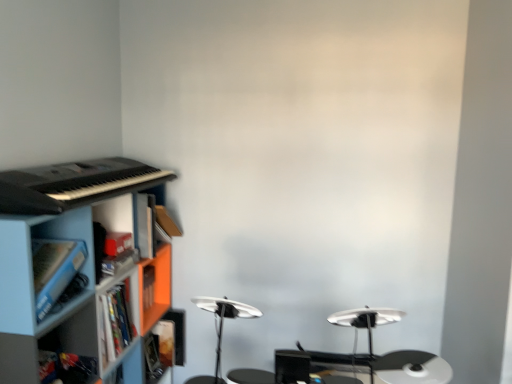
Question: Is blue plastic shelf at lower left in contact with hardcover book at lower left?

Choices:
 (A) no
 (B) yes

Answer: (A)

Question: From a real-world perspective, is blue plastic shelf at lower left positioned under hardcover book at lower left based on gravity?

Choices:
 (A) yes
 (B) no

Answer: (B)

Question: Does blue plastic shelf at lower left lie in front of hardcover book at lower left?

Choices:
 (A) no
 (B) yes

Answer: (B)

Question: Is blue plastic shelf at lower left oriented away from hardcover book at lower left?

Choices:
 (A) yes
 (B) no

Answer: (A)

Question: From the image's perspective, would you say blue plastic shelf at lower left is shown under hardcover book at lower left?

Choices:
 (A) yes
 (B) no

Answer: (B)

Question: Is orange matte cabinet at left, the first cabinet positioned from the back, bigger or smaller than blue plastic cabinet at lower left, which ranks as the 1th cabinet in front-to-back order?

Choices:
 (A) big
 (B) small

Answer: (B)

Question: From a real-world perspective, is orange matte cabinet at left, the first cabinet positioned from the back, positioned above or below blue plastic cabinet at lower left, which ranks as the 1th cabinet in front-to-back order?

Choices:
 (A) below
 (B) above

Answer: (A)

Question: Considering their positions, is orange matte cabinet at left, the first cabinet positioned from the back, located in front of or behind blue plastic cabinet at lower left, which is the second cabinet from back to front?

Choices:
 (A) front
 (B) behind

Answer: (B)

Question: From their relative heights in the image, would you say orange matte cabinet at left, the 2th cabinet when ordered from front to back, is taller or shorter than blue plastic cabinet at lower left, which is the second cabinet from back to front?

Choices:
 (A) tall
 (B) short

Answer: (B)

Question: Do you think blue plastic shelf at lower left is within blue plastic cabinet at lower left, which ranks as the 1th cabinet in front-to-back order, or outside of it?

Choices:
 (A) outside
 (B) inside

Answer: (A)

Question: Is blue plastic shelf at lower left wider or thinner than blue plastic cabinet at lower left, which ranks as the 1th cabinet in front-to-back order?

Choices:
 (A) wide
 (B) thin

Answer: (A)

Question: Based on their positions, is blue plastic shelf at lower left located to the left or right of blue plastic cabinet at lower left, which is the second cabinet from back to front?

Choices:
 (A) left
 (B) right

Answer: (B)

Question: Looking at the image, does blue plastic shelf at lower left seem bigger or smaller compared to blue plastic cabinet at lower left, which ranks as the 1th cabinet in front-to-back order?

Choices:
 (A) small
 (B) big

Answer: (B)

Question: In terms of size, does hardcover book at lower left appear bigger or smaller than blue plastic cabinet at lower left, which is the second cabinet from back to front?

Choices:
 (A) small
 (B) big

Answer: (A)

Question: From a real-world perspective, is hardcover book at lower left positioned above or below blue plastic cabinet at lower left, which ranks as the 1th cabinet in front-to-back order?

Choices:
 (A) below
 (B) above

Answer: (A)